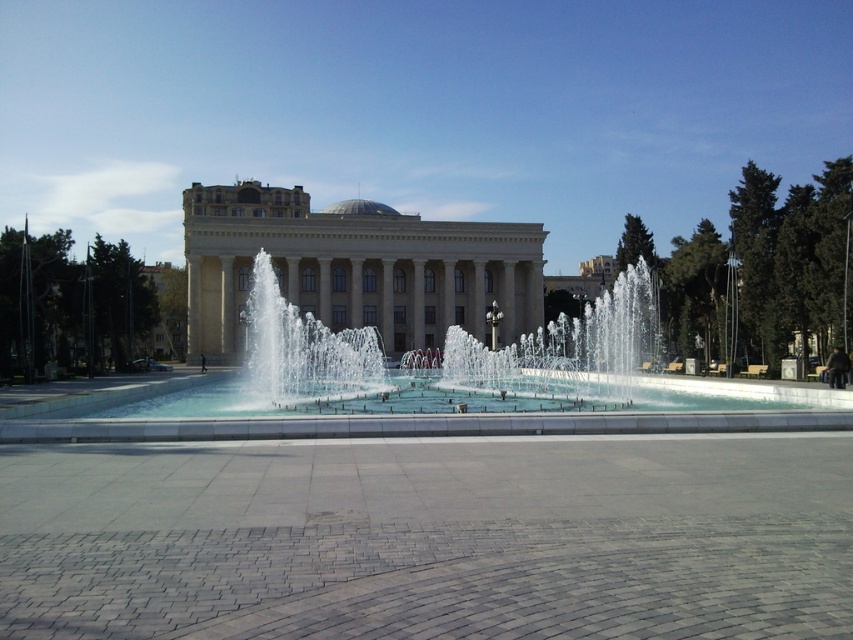
Based on the photo, which is below, clear water at center or white marble palace at center?

clear water at center is below.

Is clear water at center above white marble palace at center?

No, clear water at center is not above white marble palace at center.

The width and height of the screenshot is (853, 640). Find the location of `clear water at center`. clear water at center is located at coordinates (450, 384).

At what (x,y) coordinates should I click in order to perform the action: click on clear water at center. Please return your answer as a coordinate pair (x, y). The height and width of the screenshot is (640, 853). Looking at the image, I should click on point(450,384).